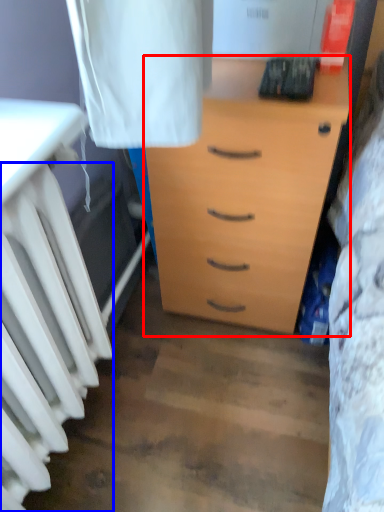
Question: Which point is further to the camera, chest of drawers (highlighted by a red box) or radiator (highlighted by a blue box)?

Choices:
 (A) chest of drawers
 (B) radiator

Answer: (A)